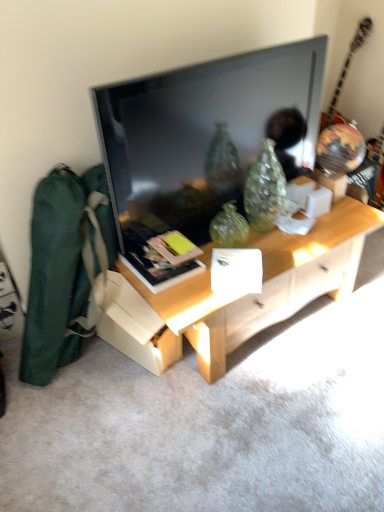
Question: Considering the positions of matte black book at center and glossy wood guitar at upper right in the image, is matte black book at center wider or thinner than glossy wood guitar at upper right?

Choices:
 (A) thin
 (B) wide

Answer: (A)

Question: Considering the relative positions of matte black book at center and glossy wood guitar at upper right in the image provided, is matte black book at center to the left or to the right of glossy wood guitar at upper right?

Choices:
 (A) right
 (B) left

Answer: (B)

Question: Estimate the real-world distances between objects in this image. Which object is closer to the matte black book at center?

Choices:
 (A) glossy wood guitar at upper right
 (B) light wood desk at center
 (C) green canvas messenger bag at left
 (D) flat screen tv at center

Answer: (C)

Question: Which of these objects is positioned closest to the glossy wood guitar at upper right?

Choices:
 (A) flat screen tv at center
 (B) green canvas messenger bag at left
 (C) matte black book at center
 (D) light wood desk at center

Answer: (A)